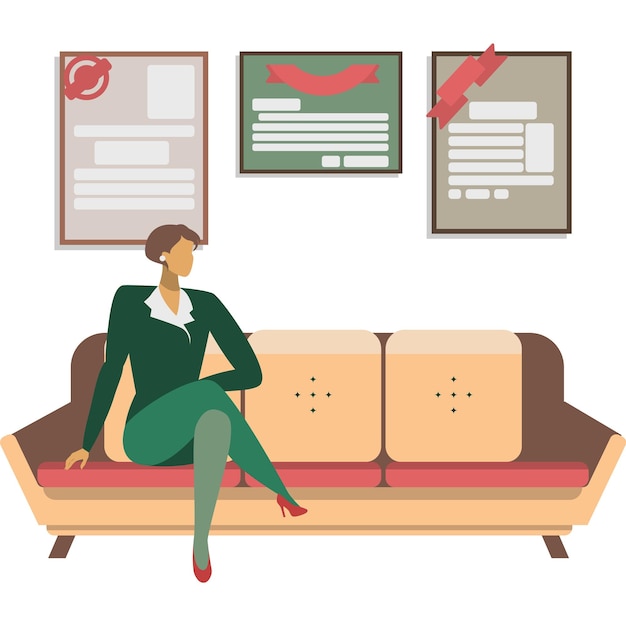
Where is `couch`? couch is located at coordinates (536, 371).